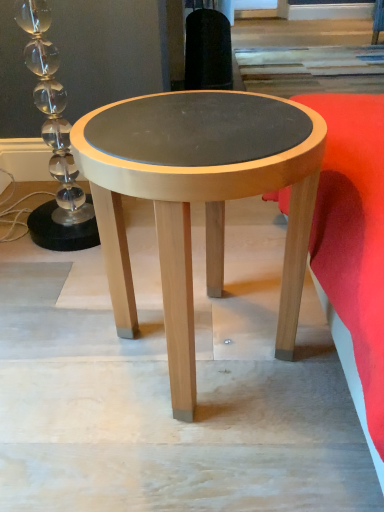
The width and height of the screenshot is (384, 512). Identify the location of unoccupied area in front of matte wood coffee table at center. (175, 463).